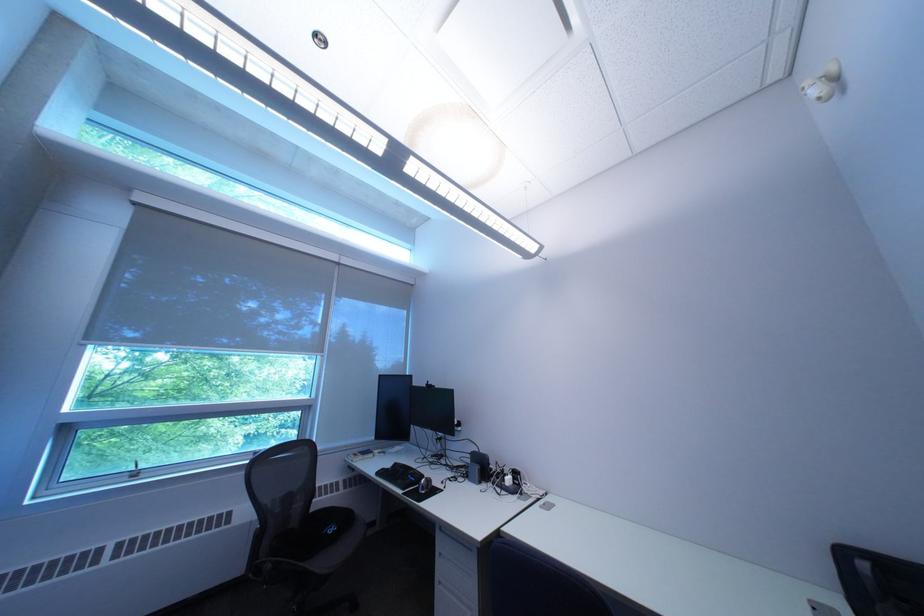
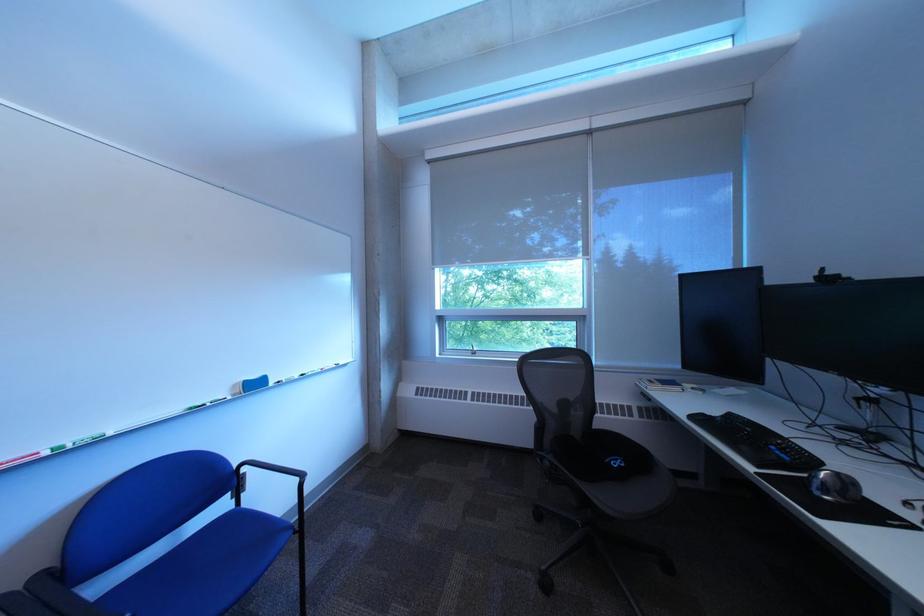
Where in the second image is the point corresponding to point 438,491 from the first image?

(841, 493)